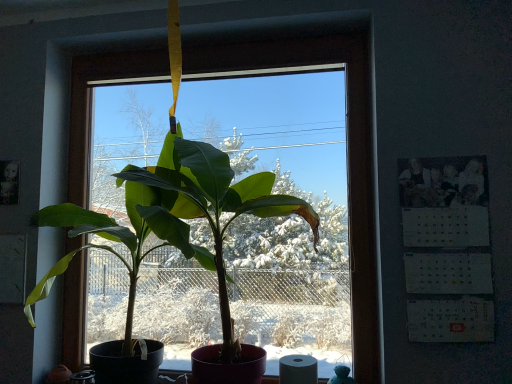
Question: From a real-world perspective, is white paper calendar at right positioned above or below white matte toilet paper at lower center?

Choices:
 (A) above
 (B) below

Answer: (A)

Question: Does point pos(400,190) appear closer or farther from the camera than point pos(311,365)?

Choices:
 (A) closer
 (B) farther

Answer: (B)

Question: Which is farther from the white paper calendar at right?

Choices:
 (A) white matte toilet paper at lower center
 (B) green matte plant at center

Answer: (B)

Question: Based on their relative distances, which object is farther from the green matte plant at center?

Choices:
 (A) white paper calendar at right
 (B) white matte toilet paper at lower center

Answer: (A)